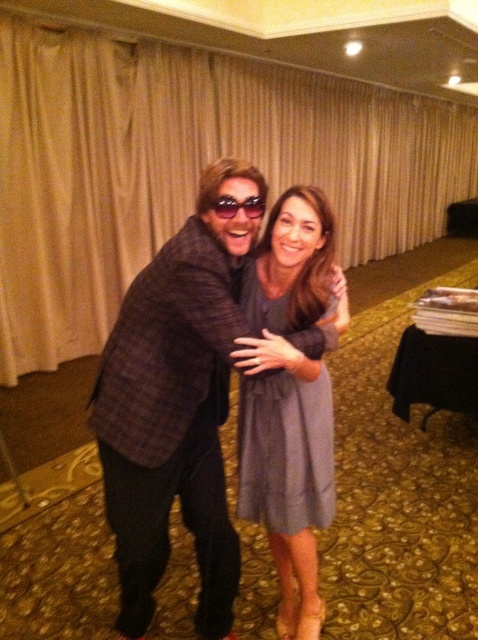
Is point (250, 472) positioned before point (213, 204)?

No, (250, 472) is further to viewer.

Between gray satin dress at center and sunglasses at center, which one appears on the left side from the viewer's perspective?

From the viewer's perspective, sunglasses at center appears more on the left side.

Is point (284, 493) positioned in front of point (227, 218)?

That is False.

At what (x,y) coordinates should I click in order to perform the action: click on gray satin dress at center. Please return your answer as a coordinate pair (x, y). This screenshot has width=478, height=640. Looking at the image, I should click on (285, 451).

Find the location of a particular element. This screenshot has height=640, width=478. plaid fabric jacket at center is located at coordinates (175, 404).

From the picture: Does plaid fabric jacket at center have a smaller size compared to sunglasses at center?

Incorrect, plaid fabric jacket at center is not smaller in size than sunglasses at center.

This screenshot has width=478, height=640. Identify the location of plaid fabric jacket at center. (175, 404).

Where is `plaid fabric jacket at center`? plaid fabric jacket at center is located at coordinates (175, 404).

Is point (149, 68) closer to camera compared to point (291, 404)?

No, (149, 68) is further to viewer.

Find the location of a particular element. This screenshot has height=640, width=478. beige fabric curtain at upper center is located at coordinates (185, 168).

Does point (95, 172) lie in front of point (260, 452)?

No.

The image size is (478, 640). I want to click on beige fabric curtain at upper center, so [x=185, y=168].